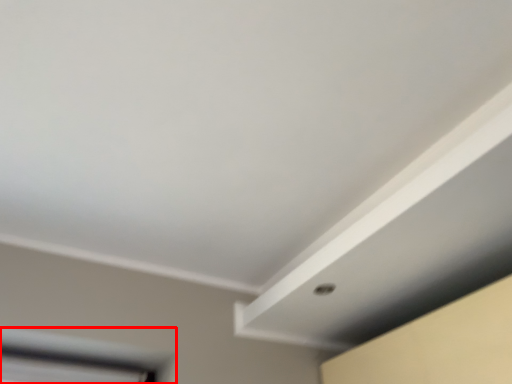
Question: From the image, what is the correct spatial relationship of window (annotated by the red box) in relation to exhaust hood?

Choices:
 (A) right
 (B) left

Answer: (B)